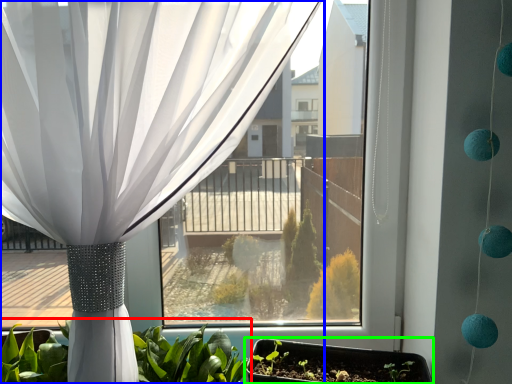
Question: Based on their relative distances, which object is farther from houseplant (highlighted by a red box)? Choose from curtain (highlighted by a blue box) and flowerpot (highlighted by a green box).

Choices:
 (A) curtain
 (B) flowerpot

Answer: (A)